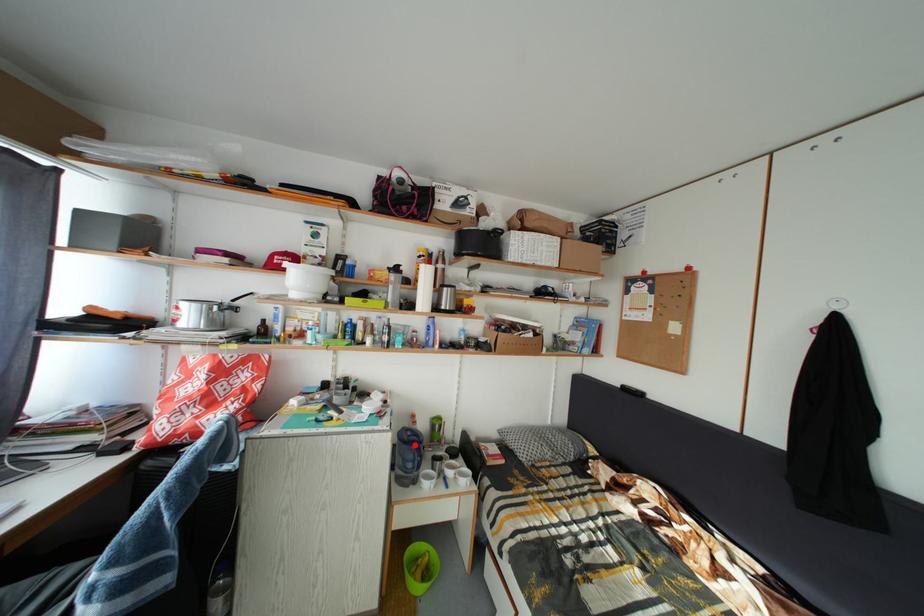
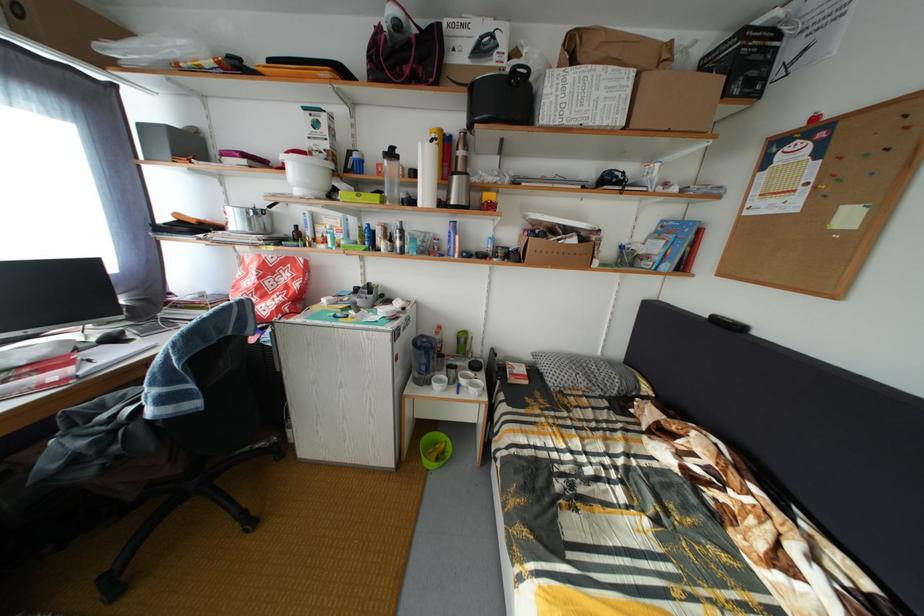
In the second image, find the point that corresponds to the highlighted location in the first image.

(428, 350)